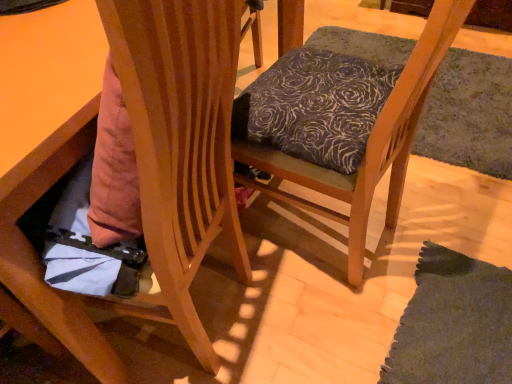
This screenshot has height=384, width=512. Describe the element at coordinates (143, 176) in the screenshot. I see `wooden chair at lower left, which is counted as the second chair, starting from the right` at that location.

In order to face wooden chair at lower left, which is counted as the second chair, starting from the right, should I rotate leftwards or rightwards?

Rotate your view left by about 25.285°.

Measure the distance between point (x=187, y=185) and camera.

The distance of point (x=187, y=185) from camera is 30.39 inches.

The width and height of the screenshot is (512, 384). I want to click on wooden chair at lower left, which is counted as the second chair, starting from the right, so click(143, 176).

In the scene shown: In order to face textured fabric cushion at center, positioned as the 2th chair in left-to-right order, should I rotate leftwards or rightwards?

Rotate your view right by about 10.302°.

What do you see at coordinates (368, 143) in the screenshot? I see `textured fabric cushion at center, the first chair when ordered from right to left` at bounding box center [368, 143].

Image resolution: width=512 pixels, height=384 pixels. I want to click on textured fabric cushion at center, positioned as the 2th chair in left-to-right order, so click(x=368, y=143).

The height and width of the screenshot is (384, 512). Identify the location of wooden chair at lower left, positioned as the 1th chair in left-to-right order. (143, 176).

Based on their positions, is textured fabric cushion at center, positioned as the 2th chair in left-to-right order, located to the left or right of wooden chair at lower left, which is counted as the second chair, starting from the right?

From the image, it's evident that textured fabric cushion at center, positioned as the 2th chair in left-to-right order, is to the right of wooden chair at lower left, which is counted as the second chair, starting from the right.

Which object is closer to the camera taking this photo, textured fabric cushion at center, the first chair when ordered from right to left, or wooden chair at lower left, which is counted as the second chair, starting from the right?

wooden chair at lower left, which is counted as the second chair, starting from the right, is in front.

Which is closer to the camera, (x=355, y=282) or (x=192, y=194)?

The point (x=192, y=194) is closer.

From the image's perspective, would you say textured fabric cushion at center, the first chair when ordered from right to left, is shown under wooden chair at lower left, which is counted as the second chair, starting from the right?

No.

From a real-world perspective, is textured fabric cushion at center, the first chair when ordered from right to left, on wooden chair at lower left, which is counted as the second chair, starting from the right?

Correct, in the physical world, textured fabric cushion at center, the first chair when ordered from right to left, is higher than wooden chair at lower left, which is counted as the second chair, starting from the right.

Which object is wider, textured fabric cushion at center, positioned as the 2th chair in left-to-right order, or wooden chair at lower left, which is counted as the second chair, starting from the right?

Wider between the two is wooden chair at lower left, which is counted as the second chair, starting from the right.

Between textured fabric cushion at center, the first chair when ordered from right to left, and wooden chair at lower left, positioned as the 1th chair in left-to-right order, which one has more height?

With more height is textured fabric cushion at center, the first chair when ordered from right to left.

Considering the relative sizes of textured fabric cushion at center, the first chair when ordered from right to left, and wooden chair at lower left, which is counted as the second chair, starting from the right, in the image provided, is textured fabric cushion at center, the first chair when ordered from right to left, smaller than wooden chair at lower left, which is counted as the second chair, starting from the right,?

Correct, textured fabric cushion at center, the first chair when ordered from right to left, occupies less space than wooden chair at lower left, which is counted as the second chair, starting from the right.

Is wooden chair at lower left, positioned as the 1th chair in left-to-right order, surrounded by textured fabric cushion at center, the first chair when ordered from right to left?

No.

Is textured fabric cushion at center, the first chair when ordered from right to left, beside wooden chair at lower left, positioned as the 1th chair in left-to-right order?

No, textured fabric cushion at center, the first chair when ordered from right to left, is not next to wooden chair at lower left, positioned as the 1th chair in left-to-right order.

Is wooden chair at lower left, positioned as the 1th chair in left-to-right order, at the back of textured fabric cushion at center, positioned as the 2th chair in left-to-right order?

No, textured fabric cushion at center, positioned as the 2th chair in left-to-right order, is not facing the opposite direction of wooden chair at lower left, positioned as the 1th chair in left-to-right order.

What's the angular difference between textured fabric cushion at center, the first chair when ordered from right to left, and wooden chair at lower left, positioned as the 1th chair in left-to-right order,'s facing directions?

textured fabric cushion at center, the first chair when ordered from right to left, and wooden chair at lower left, positioned as the 1th chair in left-to-right order, are facing 170 degrees away from each other.

What are the coordinates of `chair above the wooden chair at lower left, which is counted as the second chair, starting from the right (from a real-world perspective)` in the screenshot? It's located at (368, 143).

Is wooden chair at lower left, positioned as the 1th chair in left-to-right order, at the right side of textured fabric cushion at center, the first chair when ordered from right to left?

No.

In the scene shown: Is the depth of wooden chair at lower left, which is counted as the second chair, starting from the right, less than that of textured fabric cushion at center, the first chair when ordered from right to left?

Yes, it is.

From the picture: Which is further, (x=147, y=107) or (x=454, y=29)?

Point (x=454, y=29)

From the image's perspective, is wooden chair at lower left, which is counted as the second chair, starting from the right, located beneath textured fabric cushion at center, the first chair when ordered from right to left?

Yes.

From a real-world perspective, does wooden chair at lower left, which is counted as the second chair, starting from the right, stand above textured fabric cushion at center, the first chair when ordered from right to left?

No.

Considering the sizes of objects wooden chair at lower left, positioned as the 1th chair in left-to-right order, and textured fabric cushion at center, positioned as the 2th chair in left-to-right order, in the image provided, who is thinner, wooden chair at lower left, positioned as the 1th chair in left-to-right order, or textured fabric cushion at center, positioned as the 2th chair in left-to-right order,?

Thinner between the two is textured fabric cushion at center, positioned as the 2th chair in left-to-right order.

In terms of height, does wooden chair at lower left, which is counted as the second chair, starting from the right, look taller or shorter compared to textured fabric cushion at center, the first chair when ordered from right to left?

Clearly, wooden chair at lower left, which is counted as the second chair, starting from the right, is shorter compared to textured fabric cushion at center, the first chair when ordered from right to left.

Can you confirm if wooden chair at lower left, positioned as the 1th chair in left-to-right order, is bigger than textured fabric cushion at center, the first chair when ordered from right to left?

Indeed, wooden chair at lower left, positioned as the 1th chair in left-to-right order, has a larger size compared to textured fabric cushion at center, the first chair when ordered from right to left.

Is textured fabric cushion at center, the first chair when ordered from right to left, completely or partially inside wooden chair at lower left, positioned as the 1th chair in left-to-right order?

No, textured fabric cushion at center, the first chair when ordered from right to left, is not inside wooden chair at lower left, positioned as the 1th chair in left-to-right order.

Are wooden chair at lower left, positioned as the 1th chair in left-to-right order, and textured fabric cushion at center, the first chair when ordered from right to left, far apart?

They are positioned close to each other.

Is wooden chair at lower left, which is counted as the second chair, starting from the right, looking in the opposite direction of textured fabric cushion at center, the first chair when ordered from right to left?

wooden chair at lower left, which is counted as the second chair, starting from the right, does not have its back to textured fabric cushion at center, the first chair when ordered from right to left.

What's the angular difference between wooden chair at lower left, which is counted as the second chair, starting from the right, and textured fabric cushion at center, positioned as the 2th chair in left-to-right order,'s facing directions?

170 degrees.

At what (x,y) coordinates should I click in order to perform the action: click on chair on the left side of textured fabric cushion at center, the first chair when ordered from right to left. Please return your answer as a coordinate pair (x, y). Looking at the image, I should click on (143, 176).

This screenshot has width=512, height=384. I want to click on chair behind the wooden chair at lower left, positioned as the 1th chair in left-to-right order, so click(x=368, y=143).

Locate an element on the screen. The width and height of the screenshot is (512, 384). chair lying on the left of textured fabric cushion at center, positioned as the 2th chair in left-to-right order is located at coordinates (143, 176).